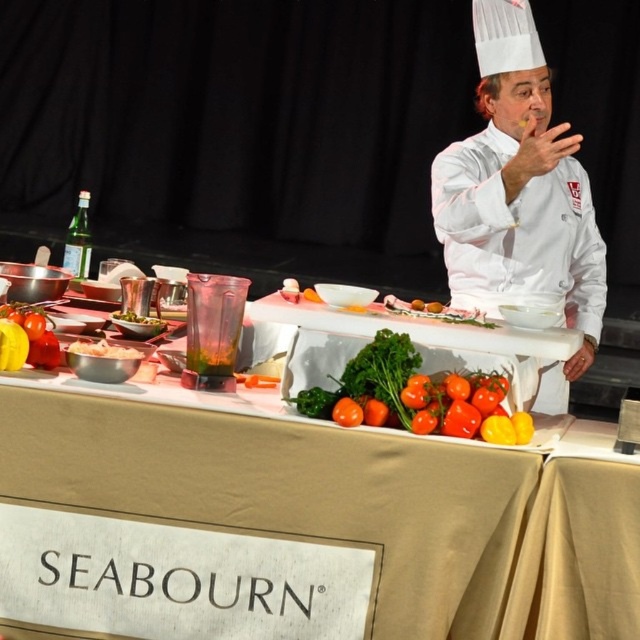
You are a kitchen assistant who needs to place a new ingredient on the table. The white chef coat at upper right is in the way. Can you move the white glossy bowl at center to the left to make space?

The white chef coat at upper right is located above the white glossy bowl at center, so moving the bowl to the left might not be necessary since the coat is above it and not blocking the table space. However, if there is space to the left, you can move the bowl there to make room.

You are a food critic attending a cooking demonstration. You want to take a photo of the glossy red tomatoes at center without moving closer than 6 feet. Is the current distance sufficient?

The glossy red tomatoes at center are 6.68 feet away from the camera, so yes, the current distance is sufficient as it exceeds the 6 feet requirement.

You are a food critic attending a cooking demo and see the glossy red tomatoes at center and the white glossy bowl at center on the table. Which object is positioned lower on the table?

The glossy red tomatoes at center are positioned lower on the table than the white glossy bowl at center.